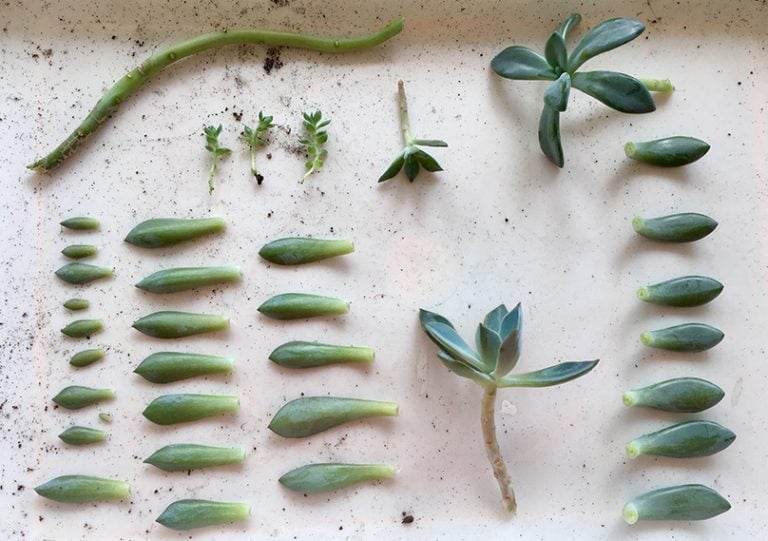
I want to click on small plants, so click(204, 141), click(257, 131), click(306, 128).